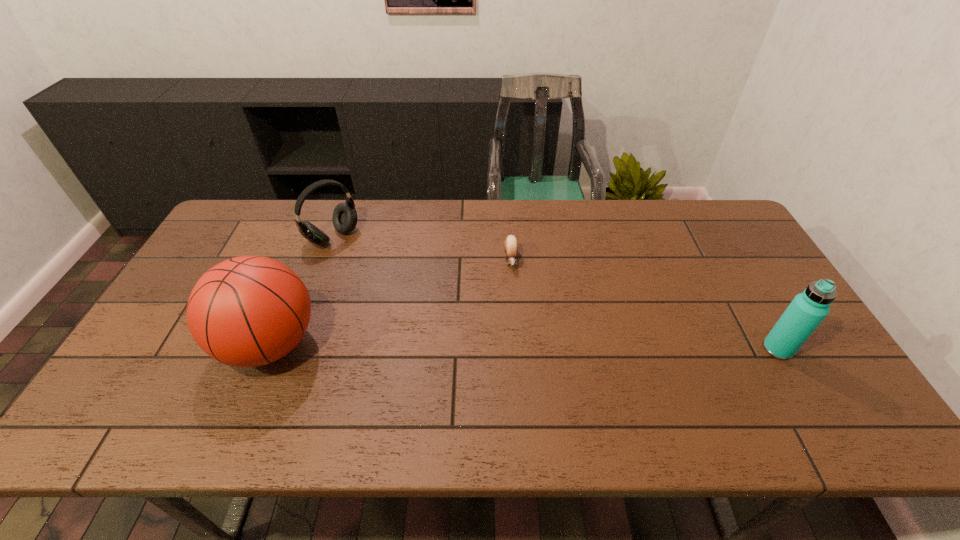
At what (x,y) coordinates should I click in order to perform the action: click on vacant region located on the front-facing side of the escargot. Please return your answer as a coordinate pair (x, y). Looking at the image, I should click on (517, 347).

What are the coordinates of `free space located 0.280m on the front-facing side of the escargot` in the screenshot? It's located at (517, 350).

You are a GUI agent. You are given a task and a screenshot of the screen. Output one action in this format:
    pyautogui.click(x=<x>, y=<y>)
    Task: Click on the free space located on the front-facing side of the escargot
    
    Given the screenshot: What is the action you would take?
    pyautogui.click(x=517, y=350)

The image size is (960, 540). Identify the location of object that is positioned at the far edge. (344, 217).

Identify the location of object located in the near edge section of the desktop. The height and width of the screenshot is (540, 960). (248, 311).

Where is `object that is at the right edge`? object that is at the right edge is located at coordinates (807, 310).

This screenshot has height=540, width=960. Identify the location of vacant space at the far edge of the desktop. (622, 206).

Image resolution: width=960 pixels, height=540 pixels. In the image, there is a desktop. In order to click on vacant space at the near edge in this screenshot , I will do pos(204,389).

This screenshot has height=540, width=960. What are the coordinates of `vacant space at the left edge of the desktop` in the screenshot? It's located at (209, 264).

Locate an element on the screen. free space at the right edge of the desktop is located at coordinates (800, 350).